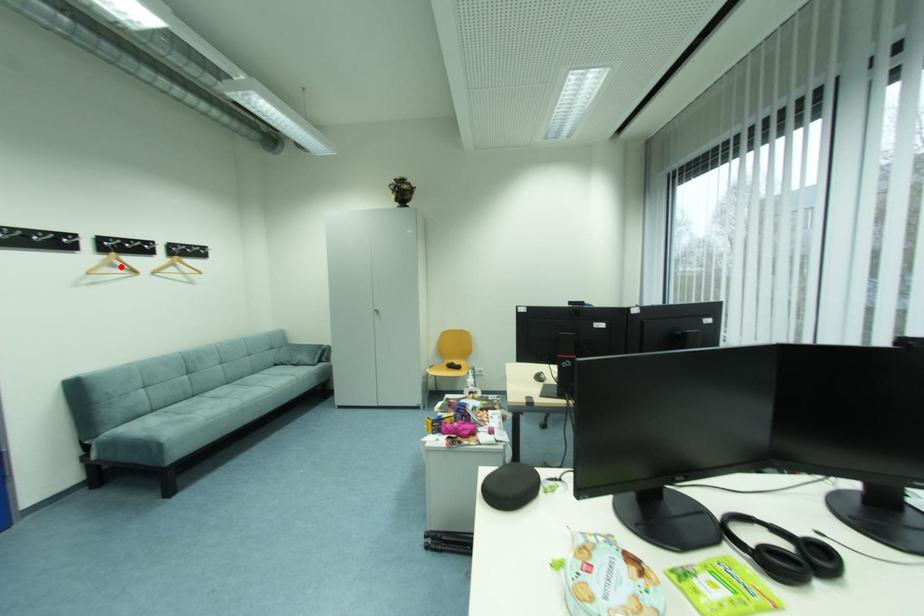
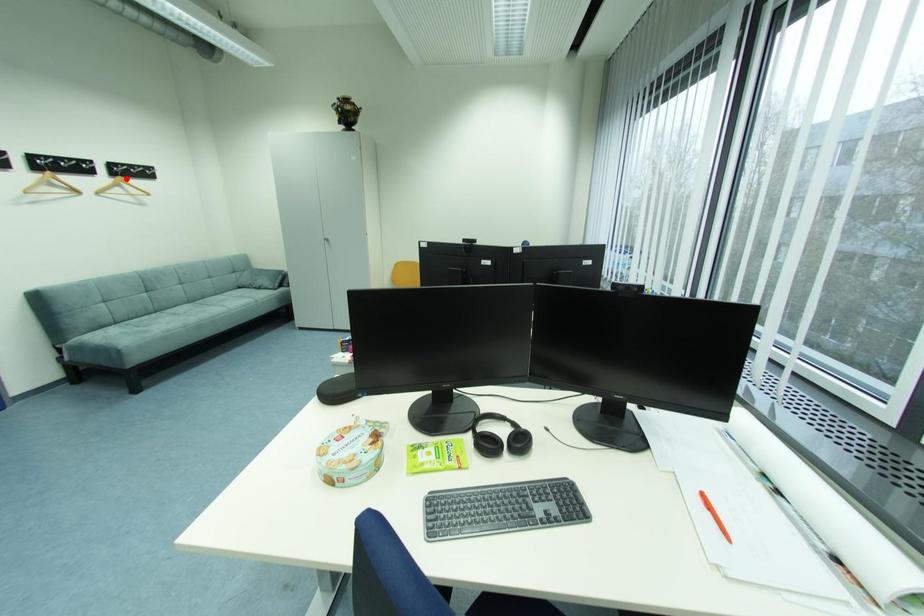
I am providing you with two images of the same scene from different viewpoints. A red point is marked on the first image and another point is marked on the second image. Does the point marked in image1 correspond to the same location as the one in image2?

No